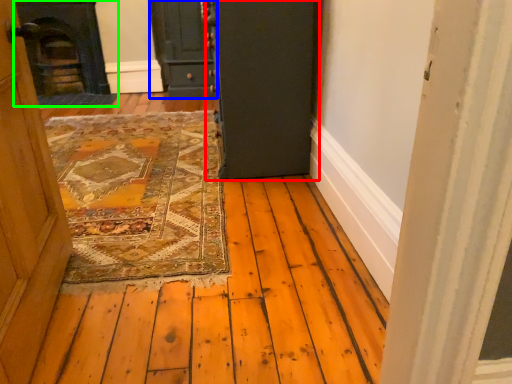
Question: Estimate the real-world distances between objects in this image. Which object is closer to door (highlighted by a red box), door (highlighted by a blue box) or fireplace (highlighted by a green box)?

Choices:
 (A) door
 (B) fireplace

Answer: (A)